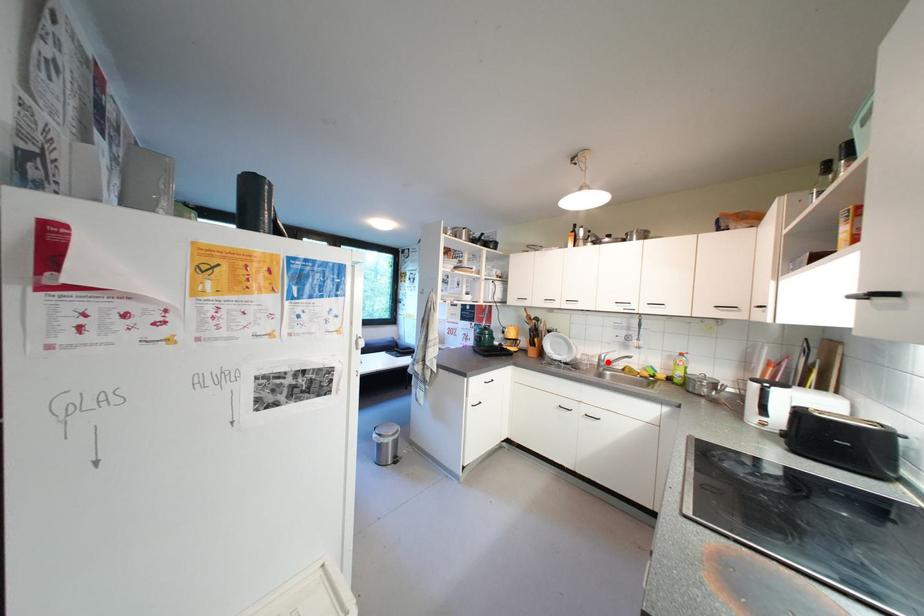
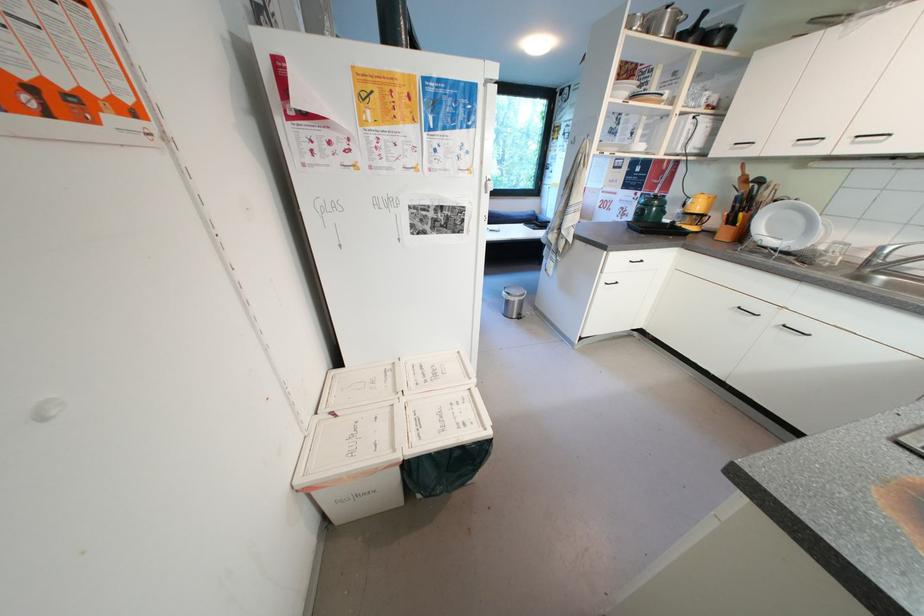
Question: I am providing you with two images of the same scene from different viewpoints. A red point is shown in image1. For the corresponding object point in image2, is it positioned nearer or farther from the camera?

Choices:
 (A) Nearer
 (B) Farther

Answer: (B)